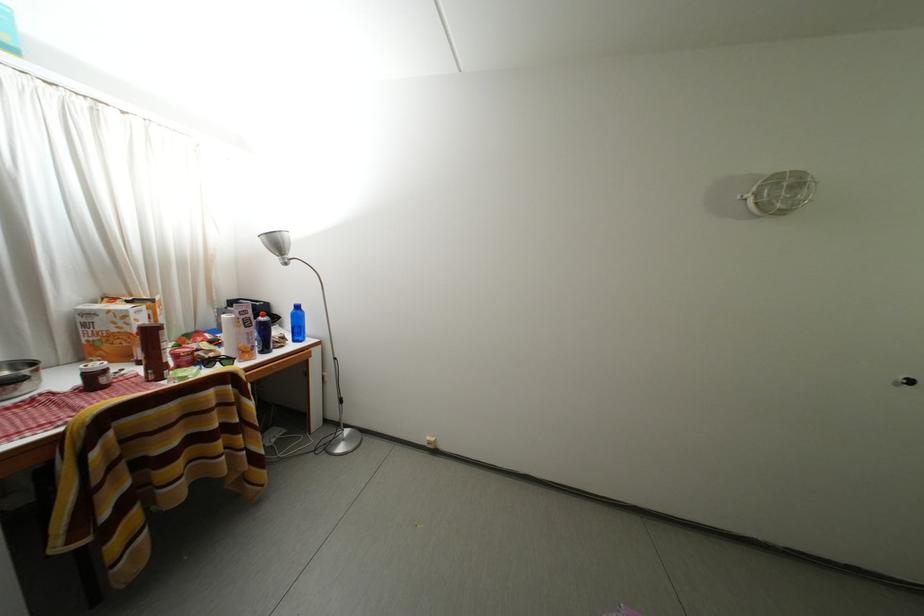
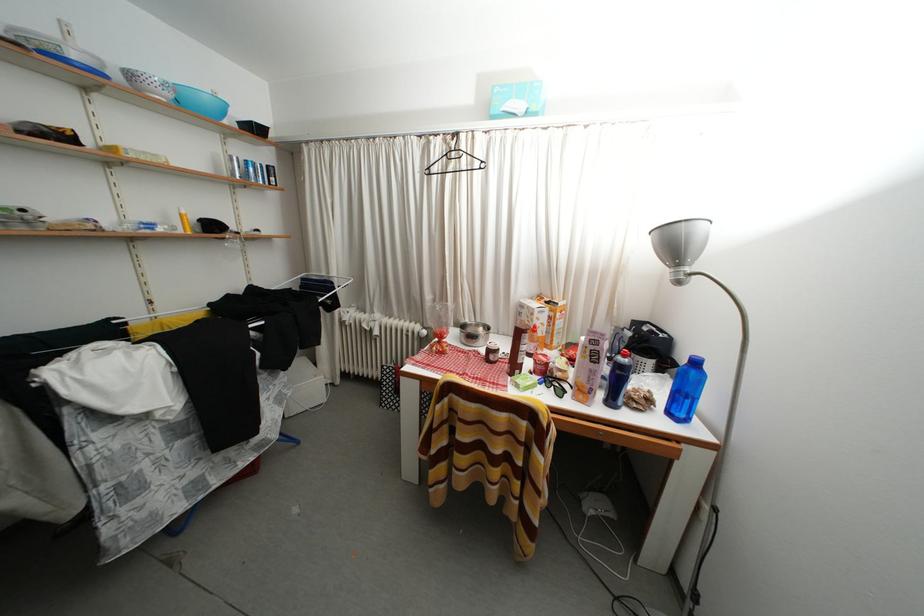
Where in the second image is the point corresponding to [302,346] from the first image?

(676, 419)